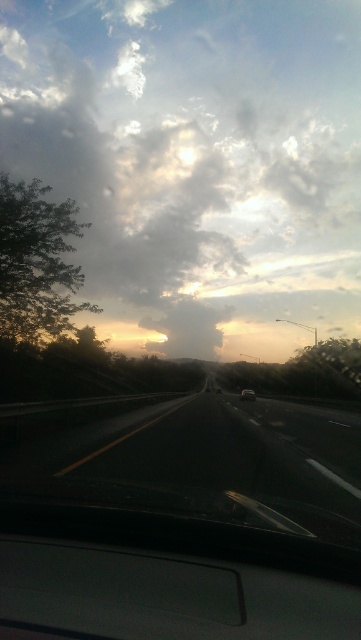
Is black asphalt highway at center bigger than shiny silver sedan at center?

Correct, black asphalt highway at center is larger in size than shiny silver sedan at center.

Who is higher up, black asphalt highway at center or shiny silver sedan at center?

black asphalt highway at center

Where is `black asphalt highway at center`? black asphalt highway at center is located at coordinates (206, 465).

Does cloudy sky at upper center have a lesser height compared to shiny silver sedan at center?

No.

Is cloudy sky at upper center taller than shiny silver sedan at center?

Correct, cloudy sky at upper center is much taller as shiny silver sedan at center.

Does point (333, 13) come closer to viewer compared to point (244, 392)?

That is False.

Find the location of a particular element. The height and width of the screenshot is (640, 361). cloudy sky at upper center is located at coordinates pyautogui.click(x=197, y=161).

Describe the element at coordinates (197, 161) in the screenshot. I see `cloudy sky at upper center` at that location.

Does cloudy sky at upper center appear on the left side of black asphalt highway at center?

No, cloudy sky at upper center is not to the left of black asphalt highway at center.

Locate an element on the screen. The height and width of the screenshot is (640, 361). cloudy sky at upper center is located at coordinates (197, 161).